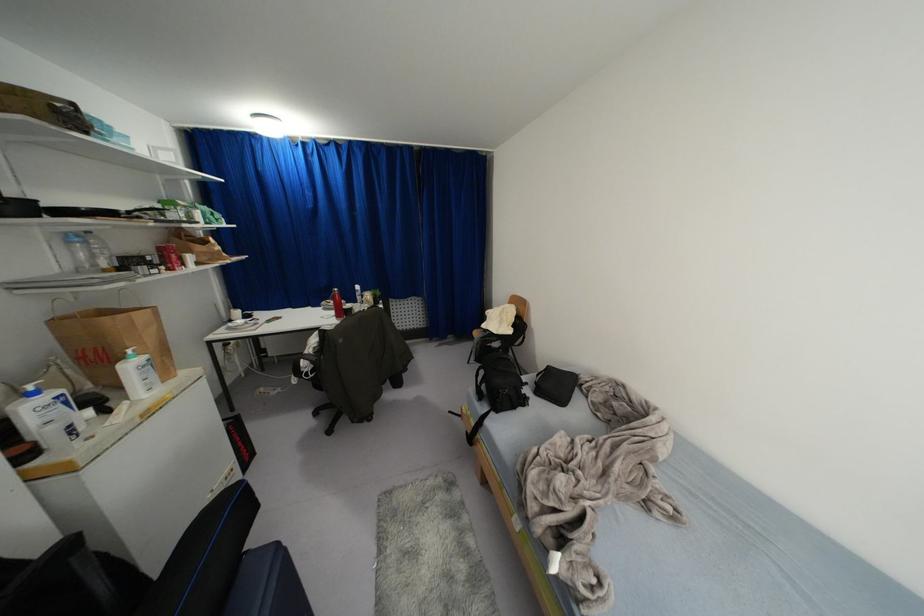
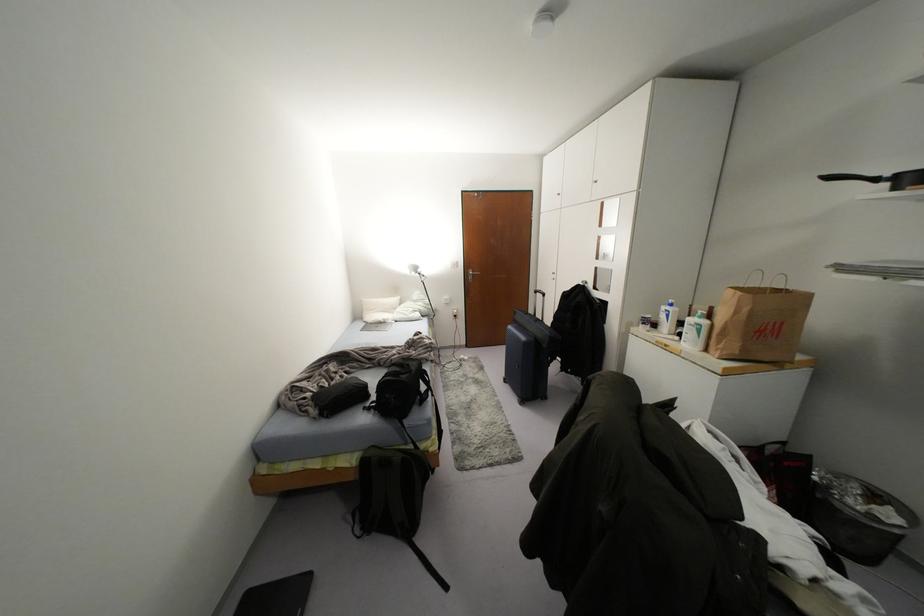
Where in the second image is the point corresponding to point 65,402 from the first image?

(666, 315)